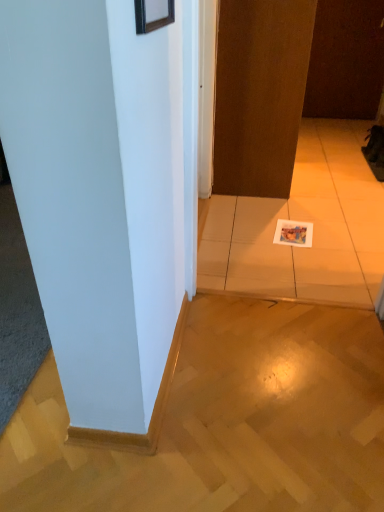
You are a GUI agent. You are given a task and a screenshot of the screen. Output one action in this format:
    pyautogui.click(x=<x>, y=<y>)
    Task: Click on the vacant region in front of brown matte door at upper right, which ranks as the second door in front-to-back order
    This screenshot has height=512, width=384.
    Given the screenshot: What is the action you would take?
    pyautogui.click(x=336, y=126)